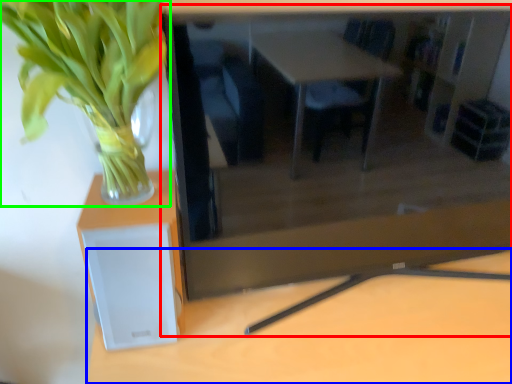
Question: Which object is the closest to the computer desk (highlighted by a red box)? Choose among these: table (highlighted by a blue box) or houseplant (highlighted by a green box).

Choices:
 (A) table
 (B) houseplant

Answer: (A)